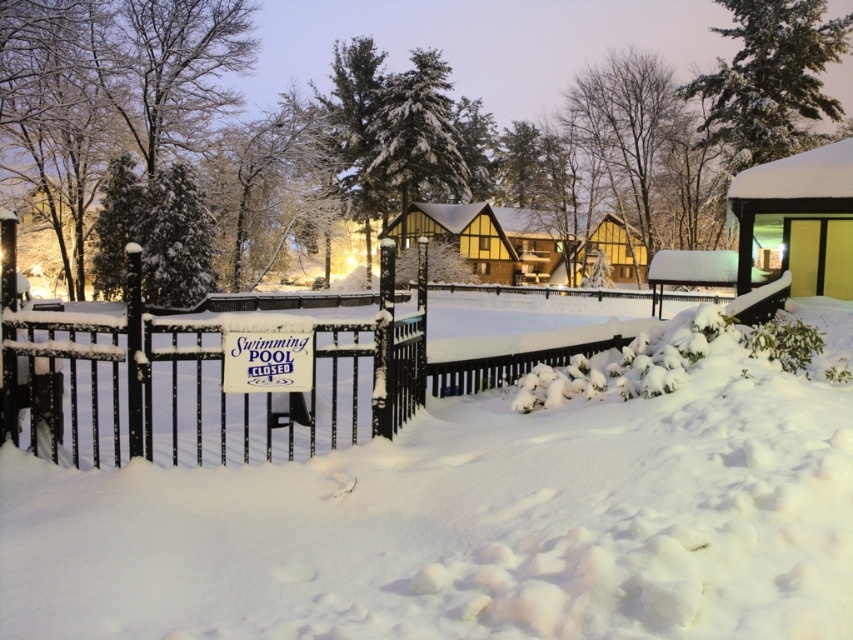
Question: Can you confirm if black metal fence at center is bigger than white plastic sign at center?

Choices:
 (A) yes
 (B) no

Answer: (A)

Question: Is black metal fence at center positioned behind white plastic sign at center?

Choices:
 (A) yes
 (B) no

Answer: (B)

Question: Which of the following is the farthest from the observer?

Choices:
 (A) white plastic sign at center
 (B) black metal fence at center

Answer: (A)

Question: Observing the image, what is the correct spatial positioning of black metal fence at center in reference to white plastic sign at center?

Choices:
 (A) left
 (B) right

Answer: (B)

Question: Which point is farther to the camera?

Choices:
 (A) white plastic sign at center
 (B) black metal fence at center

Answer: (A)